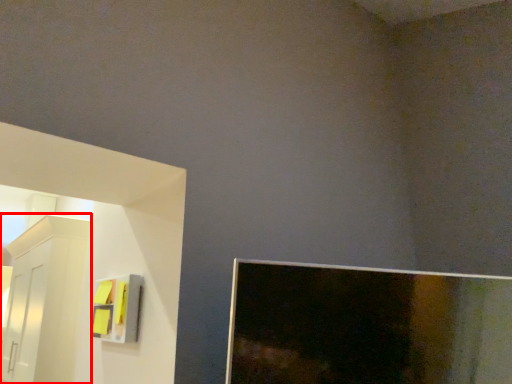
Question: Where is furniture (annotated by the red box) located in relation to cabinet in the image?

Choices:
 (A) right
 (B) left

Answer: (B)